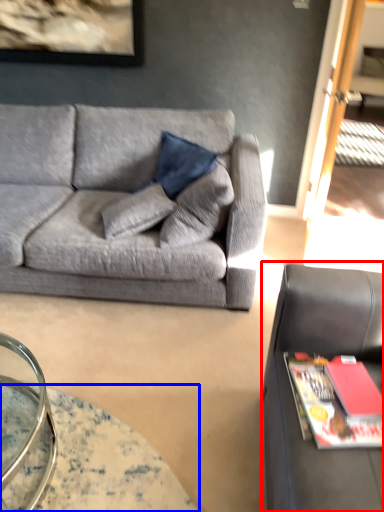
Question: Which of the following is the farthest to the observer, studio couch (highlighted by a red box) or table (highlighted by a blue box)?

Choices:
 (A) studio couch
 (B) table

Answer: (B)